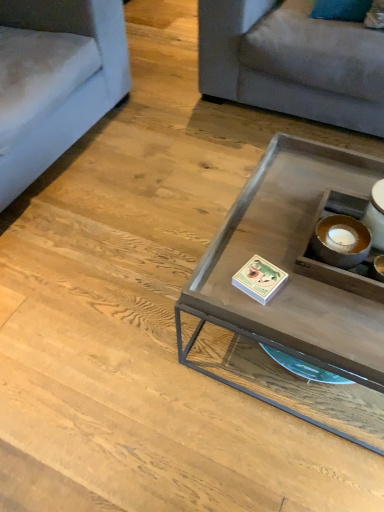
Question: Is light gray fabric couch at upper right, the 1th studio couch from the right, touching light blue fabric couch at left, acting as the first studio couch starting from the left?

Choices:
 (A) no
 (B) yes

Answer: (A)

Question: Would you say light gray fabric couch at upper right, the 1th studio couch from the right, contains light blue fabric couch at left, which is the second studio couch in right-to-left order?

Choices:
 (A) no
 (B) yes

Answer: (A)

Question: Is light gray fabric couch at upper right, which is counted as the second studio couch, starting from the left, thinner than light blue fabric couch at left, acting as the first studio couch starting from the left?

Choices:
 (A) yes
 (B) no

Answer: (B)

Question: Considering the relative sizes of light gray fabric couch at upper right, which is counted as the second studio couch, starting from the left, and light blue fabric couch at left, acting as the first studio couch starting from the left, in the image provided, is light gray fabric couch at upper right, which is counted as the second studio couch, starting from the left, shorter than light blue fabric couch at left, acting as the first studio couch starting from the left,?

Choices:
 (A) yes
 (B) no

Answer: (A)

Question: Does light gray fabric couch at upper right, which is counted as the second studio couch, starting from the left, appear on the right side of light blue fabric couch at left, acting as the first studio couch starting from the left?

Choices:
 (A) yes
 (B) no

Answer: (A)

Question: Considering the relative sizes of light gray fabric couch at upper right, which is counted as the second studio couch, starting from the left, and light blue fabric couch at left, which is the second studio couch in right-to-left order, in the image provided, is light gray fabric couch at upper right, which is counted as the second studio couch, starting from the left, smaller than light blue fabric couch at left, which is the second studio couch in right-to-left order,?

Choices:
 (A) no
 (B) yes

Answer: (B)

Question: Is light gray fabric couch at upper right, the 1th studio couch from the right, smaller than matte glass coffee table at center?

Choices:
 (A) no
 (B) yes

Answer: (A)

Question: Is light gray fabric couch at upper right, the 1th studio couch from the right, next to matte glass coffee table at center?

Choices:
 (A) yes
 (B) no

Answer: (B)

Question: Is light gray fabric couch at upper right, which is counted as the second studio couch, starting from the left, taller than matte glass coffee table at center?

Choices:
 (A) no
 (B) yes

Answer: (B)

Question: Does light gray fabric couch at upper right, which is counted as the second studio couch, starting from the left, lie behind matte glass coffee table at center?

Choices:
 (A) yes
 (B) no

Answer: (A)

Question: From a real-world perspective, is light gray fabric couch at upper right, the 1th studio couch from the right, positioned under matte glass coffee table at center based on gravity?

Choices:
 (A) no
 (B) yes

Answer: (A)

Question: From a real-world perspective, is light gray fabric couch at upper right, the 1th studio couch from the right, physically above matte glass coffee table at center?

Choices:
 (A) no
 (B) yes

Answer: (B)

Question: Does matte glass coffee table at center appear on the left side of light gray fabric couch at upper right, which is counted as the second studio couch, starting from the left?

Choices:
 (A) no
 (B) yes

Answer: (B)